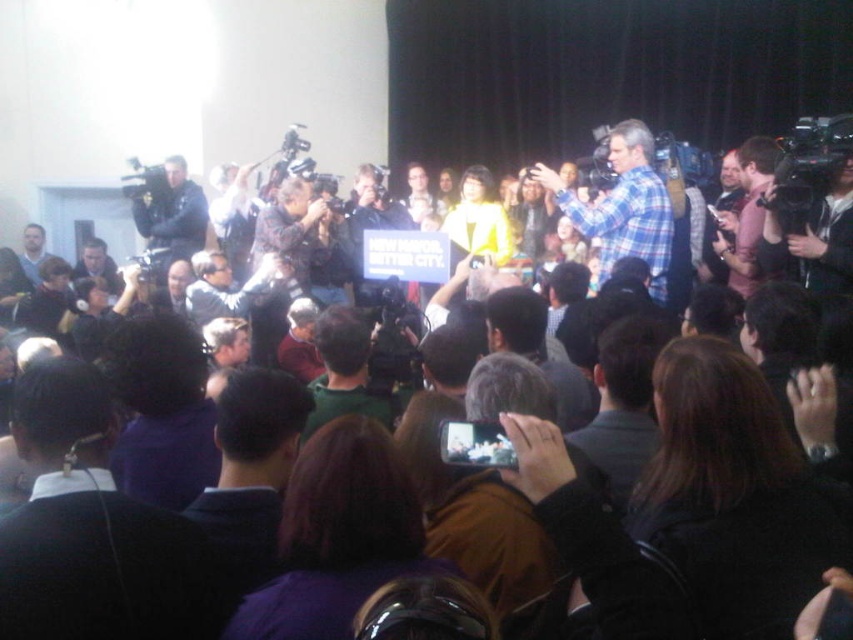
You are standing in the crowd at the press event shown in the image. You need to locate the green fabric shirt at center. Where would you look to find it?

The green fabric shirt at center is located at the 2D coordinates point [346,372] in the image.

Based on the scene description, can you determine if the dark brown hair at center is wider than the purple fabric at center?

The dark brown hair at center might be wider than purple fabric at center according to the description.

You are a photographer standing at the back of the room with a camera that has a maximum focus range of 2 meters. You want to take a clear photo of the dark brown hair at center. Can your camera focus on it?

The dark brown hair at center is 1.66 meters away from the viewer. Since the camera can focus up to 2 meters, it can capture the dark brown hair at center clearly within that range.